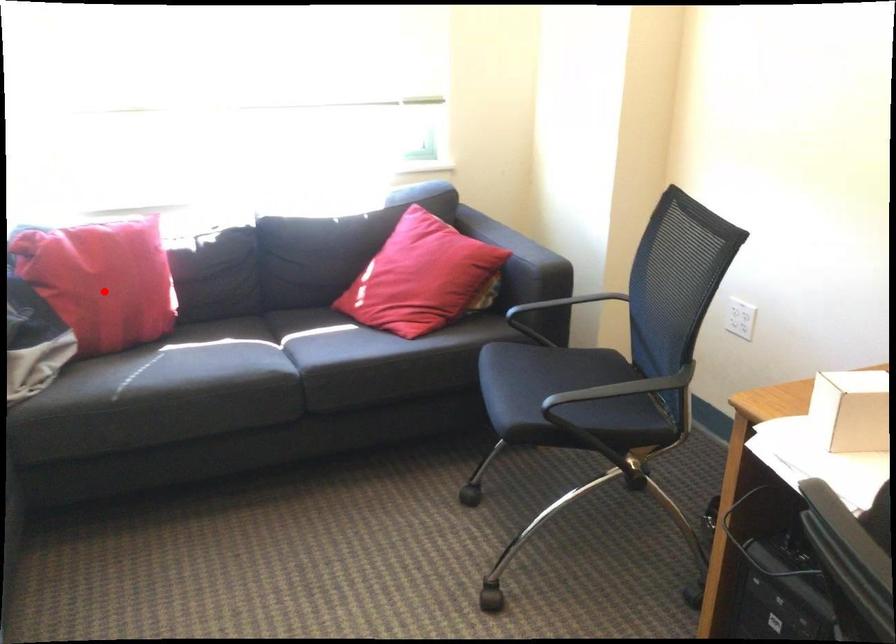
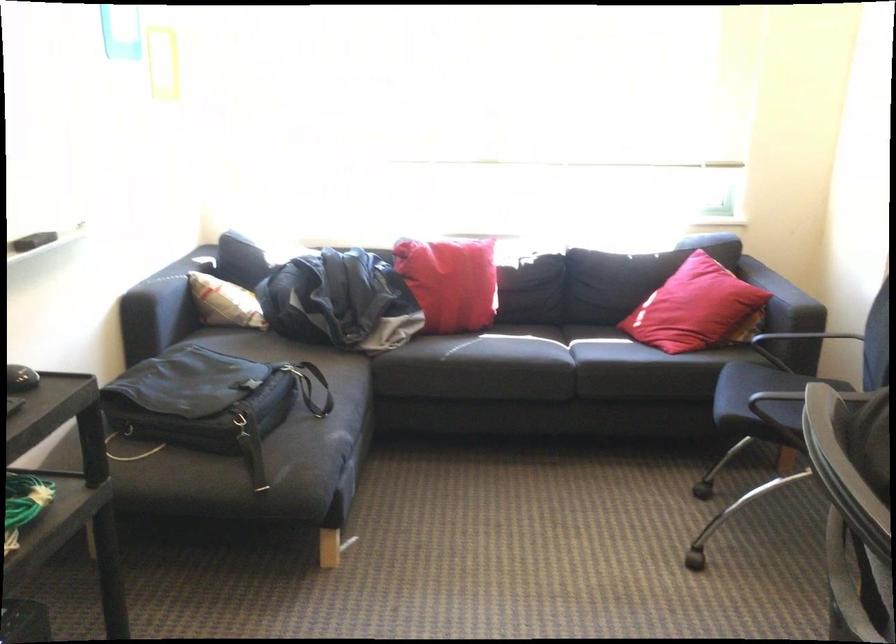
Question: I am providing you with two images of the same scene from different viewpoints. A red point is shown in image1. For the corresponding object point in image2, is it positioned nearer or farther from the camera?

Choices:
 (A) Nearer
 (B) Farther

Answer: (B)